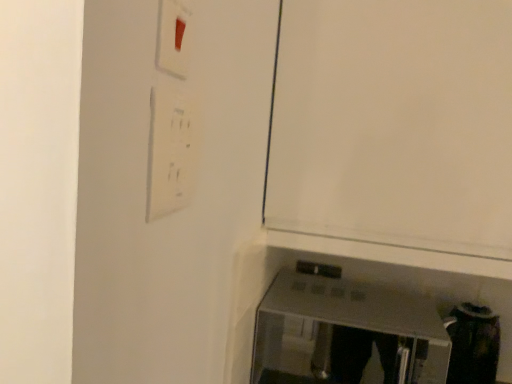
Question: Does white plastic light switch at upper left touch white matte door at center?

Choices:
 (A) no
 (B) yes

Answer: (A)

Question: Is white plastic light switch at upper left surrounding white matte door at center?

Choices:
 (A) no
 (B) yes

Answer: (A)

Question: Can you confirm if white plastic light switch at upper left is bigger than white matte door at center?

Choices:
 (A) yes
 (B) no

Answer: (B)

Question: Is the depth of white plastic light switch at upper left less than that of white matte door at center?

Choices:
 (A) no
 (B) yes

Answer: (B)

Question: From a real-world perspective, is white plastic light switch at upper left physically below white matte door at center?

Choices:
 (A) no
 (B) yes

Answer: (B)

Question: Does white plastic light switch at upper left have a smaller size compared to white matte door at center?

Choices:
 (A) yes
 (B) no

Answer: (A)

Question: Is satin silver toaster at lower right to the right of white matte door at center from the viewer's perspective?

Choices:
 (A) no
 (B) yes

Answer: (A)

Question: Does satin silver toaster at lower right come in front of white matte door at center?

Choices:
 (A) yes
 (B) no

Answer: (B)

Question: Does satin silver toaster at lower right appear on the left side of white matte door at center?

Choices:
 (A) yes
 (B) no

Answer: (A)

Question: From the image's perspective, is satin silver toaster at lower right on white matte door at center?

Choices:
 (A) no
 (B) yes

Answer: (A)

Question: From the image's perspective, is satin silver toaster at lower right under white matte door at center?

Choices:
 (A) no
 (B) yes

Answer: (B)

Question: Does satin silver toaster at lower right touch white matte door at center?

Choices:
 (A) no
 (B) yes

Answer: (A)

Question: Does white matte door at center have a lesser height compared to white plastic light switch at upper left?

Choices:
 (A) yes
 (B) no

Answer: (B)